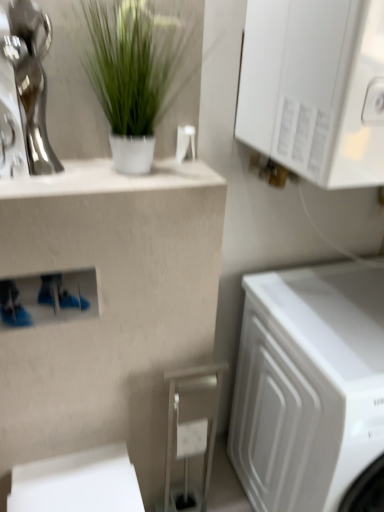
Find the location of a particular element. The height and width of the screenshot is (512, 384). vacant space in between shiny silver statue at upper left and green matte plant at upper center is located at coordinates (70, 172).